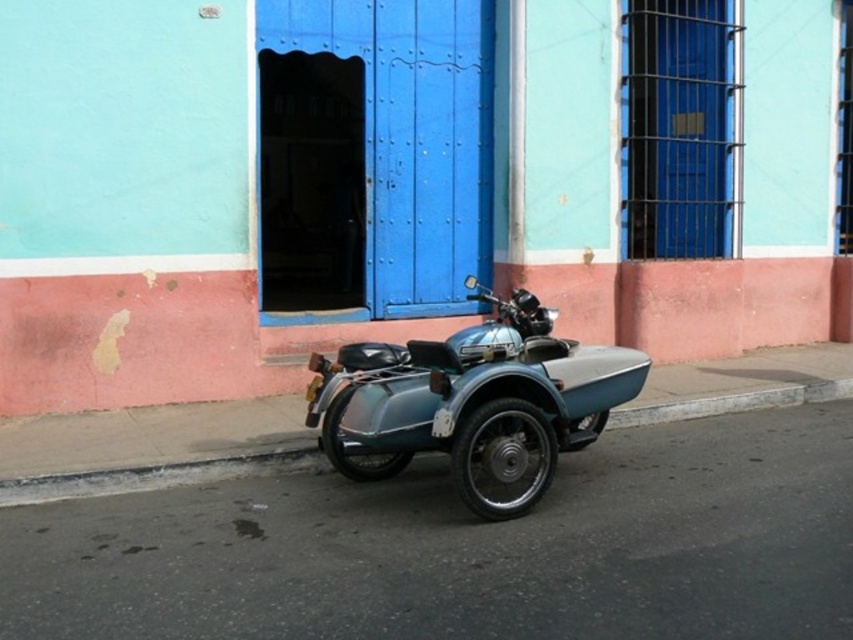
You are a delivery person needing to park your motorcycle on the street. The image shows a metallic teal motorcycle at center and a gray concrete curb at lower left. Is the motorcycle currently parked on the curb?

The metallic teal motorcycle at center is positioned over gray concrete curb at lower left, so yes, the motorcycle is parked on the curb.

You are a delivery person with a package that needs to be placed exactly between the metallic teal motorcycle at center and the gray concrete curb at lower left. What is the minimum distance you need to move from the motorcycle to reach the midpoint?

The metallic teal motorcycle at center and gray concrete curb at lower left are 5.08 feet apart, so the midpoint is 2.54 feet away from the motorcycle. You need to move at least 2.54 feet from the motorcycle to reach the midpoint.

From the picture: You are a delivery person trying to park your motorcycle so that it doesn not block the sidewalk. The sidewalk is located to the right of the gray concrete curb at lower left. Based on the image, is the metallic teal motorcycle at center currently parked in a way that it won not block the sidewalk?

The metallic teal motorcycle at center is positioned on the left side of the gray concrete curb at lower left. Since the sidewalk is to the right of the curb, the motorcycle is parked on the street side of the curb and therefore not blocking the sidewalk.